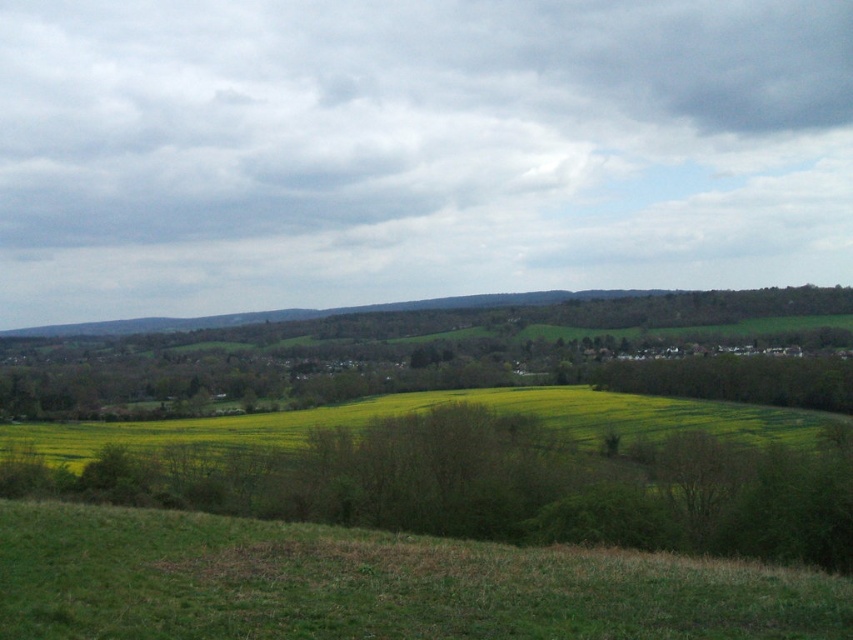
Who is taller, green grassy hill at lower center or yellow-green grass at center?

Standing taller between the two is yellow-green grass at center.

Does green grassy hill at lower center have a lesser height compared to yellow-green grass at center?

Indeed, green grassy hill at lower center has a lesser height compared to yellow-green grass at center.

Between point (265, 636) and point (337, 406), which one is positioned behind?

The point (337, 406) is more distant.

Where is `green grassy hill at lower center`? The image size is (853, 640). green grassy hill at lower center is located at coordinates (373, 584).